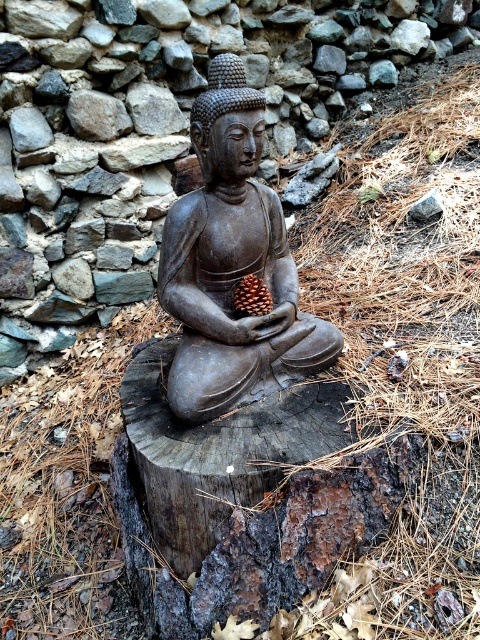
You are a visitor at a garden and see the matte brown statue at center and the brown matte pine cone at center. Which object is bigger?

The matte brown statue at center is larger than the brown matte pine cone at center.

You are standing in a garden and want to take a photo of the matte gray statue at center. If you are currently 10 feet away from it, can you step forward to get a closer shot without moving the statue?

The matte gray statue at center is 9.40 feet away from the viewer. Since you are currently 10 feet away, stepping forward by 0.6 feet would allow you to get closer to the statue without moving it.

You are a photographer wanting to capture both the matte brown statue at center and the brown matte pine cone at center in a single shot. Since both are at the center, will the statue block the pine cone from view?

The matte brown statue at center is in front of the brown matte pine cone at center, so the statue will block the pine cone from view.